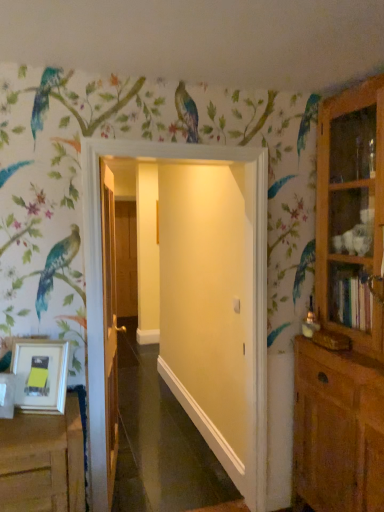
Where is `unoccupied space behind white matte door at center, the 3th door in the left-to-right sequence`? This screenshot has width=384, height=512. unoccupied space behind white matte door at center, the 3th door in the left-to-right sequence is located at coordinates (178, 479).